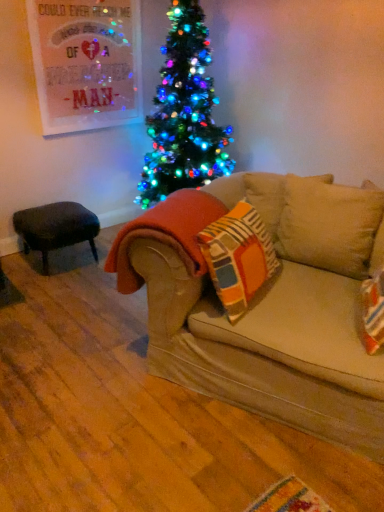
Question: Is beige fabric couch at center inside or outside of velvet dark brown stool at left?

Choices:
 (A) outside
 (B) inside

Answer: (A)

Question: In terms of width, does beige fabric couch at center look wider or thinner when compared to velvet dark brown stool at left?

Choices:
 (A) wide
 (B) thin

Answer: (A)

Question: Which of these objects is positioned closest to the orange fleece blanket at center?

Choices:
 (A) velvet dark brown stool at left
 (B) beige fabric couch at center

Answer: (B)

Question: Estimate the real-world distances between objects in this image. Which object is closer to the velvet dark brown stool at left?

Choices:
 (A) beige fabric couch at center
 (B) orange fleece blanket at center

Answer: (B)